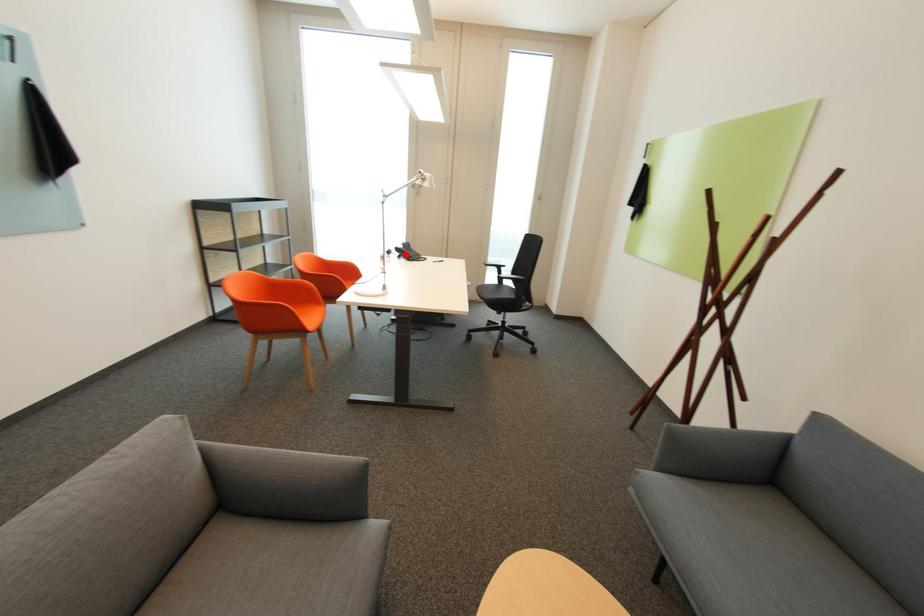
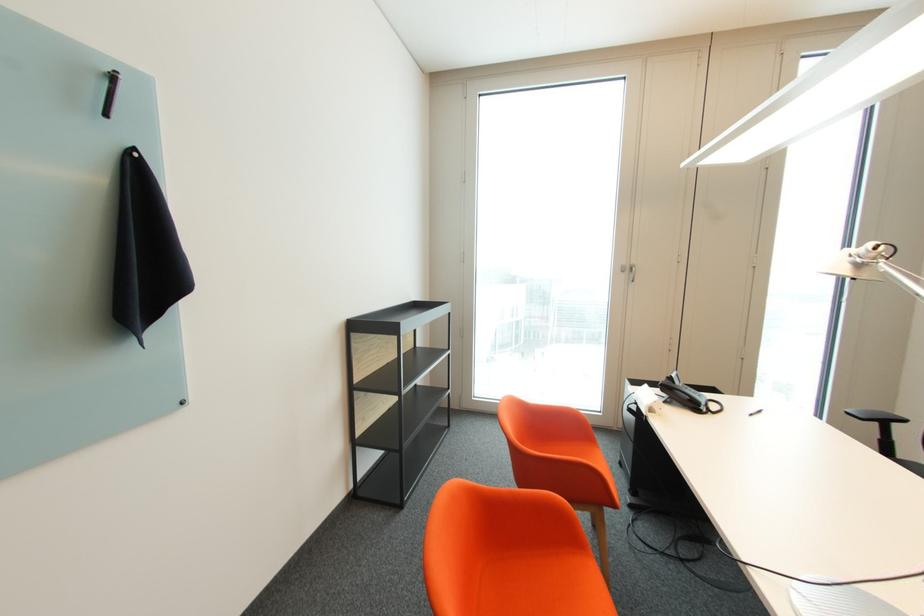
Question: I am providing you with two images of the same scene from different viewpoints. Given a red point in image1, look at the same physical point in image2. Is it:

Choices:
 (A) Closer to the viewpoint
 (B) Farther from the viewpoint

Answer: (B)